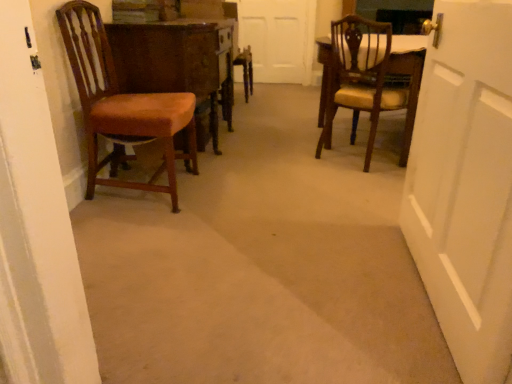
Question: From the image's perspective, does matte brown chair at right, the 1th chair when ordered from right to left, appear lower than matte brown chair at left, the 2th chair when ordered from right to left?

Choices:
 (A) no
 (B) yes

Answer: (A)

Question: Considering the relative positions of matte brown chair at right, the 1th chair when ordered from right to left, and matte brown chair at left, which ranks as the 1th chair in left-to-right order, in the image provided, is matte brown chair at right, the 1th chair when ordered from right to left, in front of matte brown chair at left, which ranks as the 1th chair in left-to-right order,?

Choices:
 (A) yes
 (B) no

Answer: (B)

Question: Is matte brown chair at right, the 1th chair when ordered from right to left, aimed at matte brown chair at left, the 2th chair when ordered from right to left?

Choices:
 (A) yes
 (B) no

Answer: (B)

Question: Would you say matte brown chair at right, which is the second chair from left to right, contains matte brown chair at left, the 2th chair when ordered from right to left?

Choices:
 (A) yes
 (B) no

Answer: (B)

Question: Is matte brown chair at right, which is the second chair from left to right, far from matte brown chair at left, the 2th chair when ordered from right to left?

Choices:
 (A) no
 (B) yes

Answer: (B)

Question: Is point click(304, 29) positioned closer to the camera than point click(170, 162)?

Choices:
 (A) farther
 (B) closer

Answer: (A)

Question: From their relative heights in the image, would you say white matte door at center is taller or shorter than matte brown chair at left, which ranks as the 1th chair in left-to-right order?

Choices:
 (A) tall
 (B) short

Answer: (A)

Question: Considering the positions of white matte door at center and matte brown chair at left, which ranks as the 1th chair in left-to-right order, in the image, is white matte door at center wider or thinner than matte brown chair at left, which ranks as the 1th chair in left-to-right order,?

Choices:
 (A) thin
 (B) wide

Answer: (A)

Question: From the image's perspective, is white matte door at center positioned above or below matte brown chair at left, the 2th chair when ordered from right to left?

Choices:
 (A) below
 (B) above

Answer: (B)

Question: In the image, is white matte door at center positioned in front of or behind matte brown chair at right, which is the second chair from left to right?

Choices:
 (A) front
 (B) behind

Answer: (B)

Question: Based on their sizes in the image, would you say white matte door at center is bigger or smaller than matte brown chair at right, the 1th chair when ordered from right to left?

Choices:
 (A) big
 (B) small

Answer: (B)

Question: From a real-world perspective, is white matte door at center physically located above or below matte brown chair at right, the 1th chair when ordered from right to left?

Choices:
 (A) above
 (B) below

Answer: (A)

Question: Considering the positions of point (245, 1) and point (334, 71), is point (245, 1) closer or farther from the camera than point (334, 71)?

Choices:
 (A) closer
 (B) farther

Answer: (B)

Question: Based on their positions, is matte brown chair at right, the 1th chair when ordered from right to left, located to the left or right of white matte door at center?

Choices:
 (A) right
 (B) left

Answer: (A)

Question: In terms of width, does matte brown chair at right, which is the second chair from left to right, look wider or thinner when compared to white matte door at center?

Choices:
 (A) thin
 (B) wide

Answer: (B)